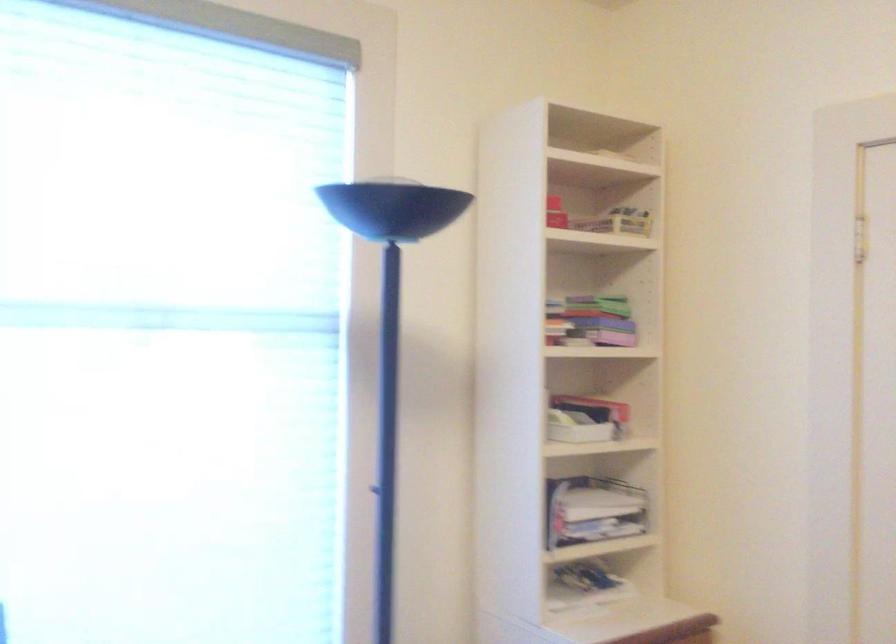
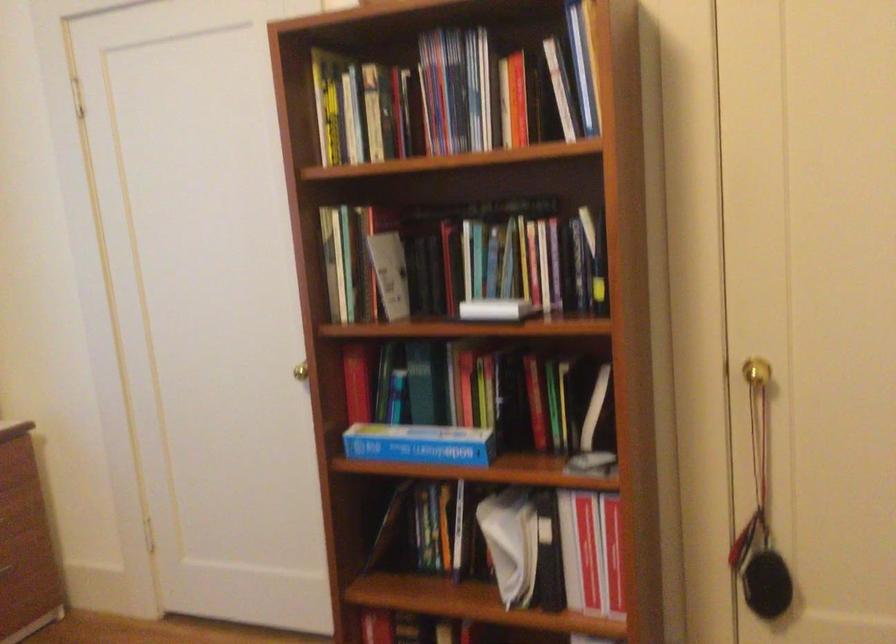
Question: The images are taken continuously from a first-person perspective. In which direction is your viewpoint rotating?

Choices:
 (A) Left
 (B) Right
 (C) Up
 (D) Down

Answer: (B)